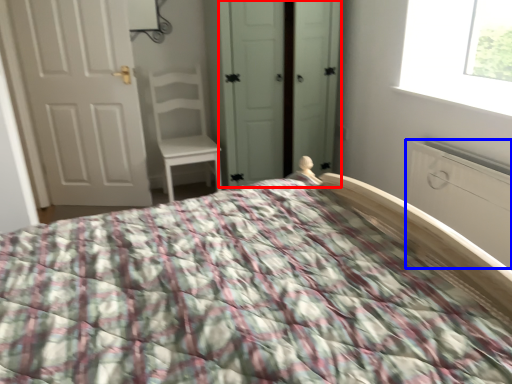
Question: Which object is further to the camera taking this photo, screen door (highlighted by a red box) or armoire (highlighted by a blue box)?

Choices:
 (A) screen door
 (B) armoire

Answer: (A)